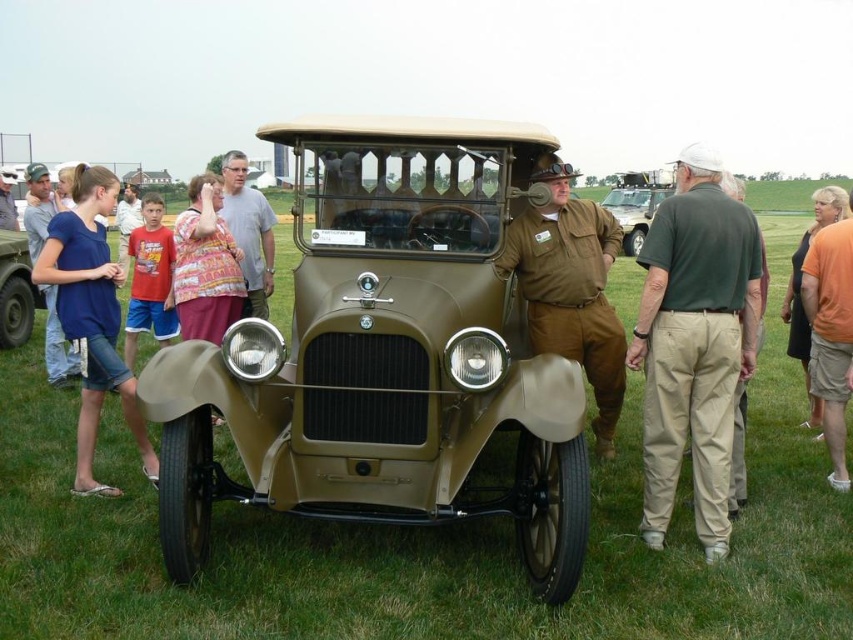
Between point (666, 257) and point (151, 268), which one is positioned behind?

Positioned behind is point (151, 268).

Is khaki cotton pants at center to the left of red cotton shirt at left from the viewer's perspective?

No, khaki cotton pants at center is not to the left of red cotton shirt at left.

Between point (657, 492) and point (142, 282), which one is positioned behind?

Point (142, 282)

The height and width of the screenshot is (640, 853). What are the coordinates of `khaki cotton pants at center` in the screenshot? It's located at pos(694,344).

Is matte khaki pants at left above matte khaki pants at center?

No.

Does matte khaki pants at left come in front of matte khaki pants at center?

Yes, matte khaki pants at left is closer to the viewer.

Is point (44, 176) in front of point (10, 204)?

Yes, it is.

I want to click on matte khaki pants at left, so click(x=38, y=208).

Between gray cotton shirt at center and matte olive green car at center, which one is positioned lower?

Positioned lower is gray cotton shirt at center.

From the picture: Who is more distant from viewer, (244, 244) or (636, 200)?

The point (636, 200) is behind.

Identify the location of gray cotton shirt at center. (248, 230).